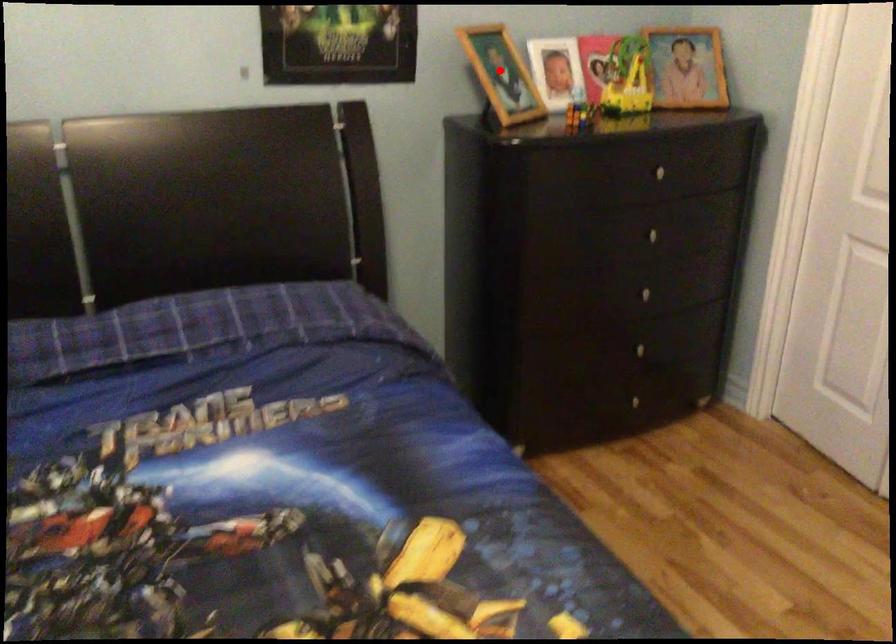
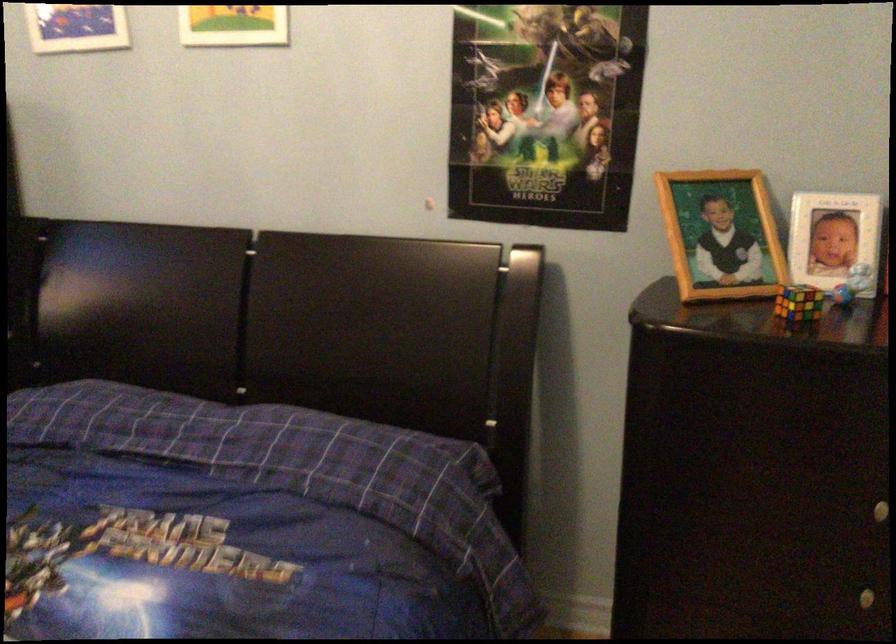
Where in the second image is the point corresponding to the highlighted location from the first image?

(720, 234)